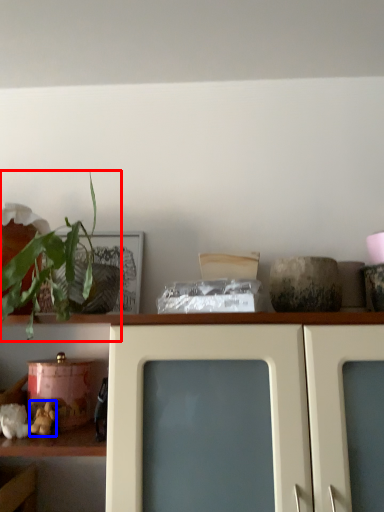
Question: Which object appears farthest to the camera in this image, houseplant (highlighted by a red box) or stuff (highlighted by a blue box)?

Choices:
 (A) houseplant
 (B) stuff

Answer: (B)